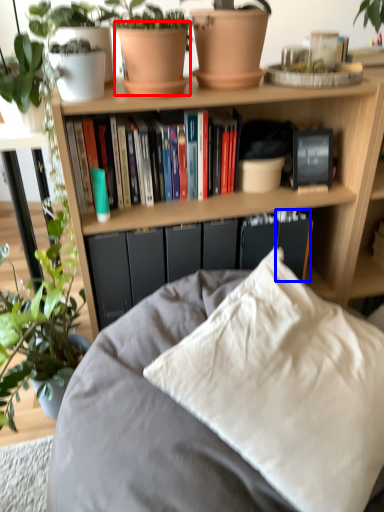
Question: Which object is closer to the camera taking this photo, flowerpot (highlighted by a red box) or paperback book (highlighted by a blue box)?

Choices:
 (A) flowerpot
 (B) paperback book

Answer: (A)